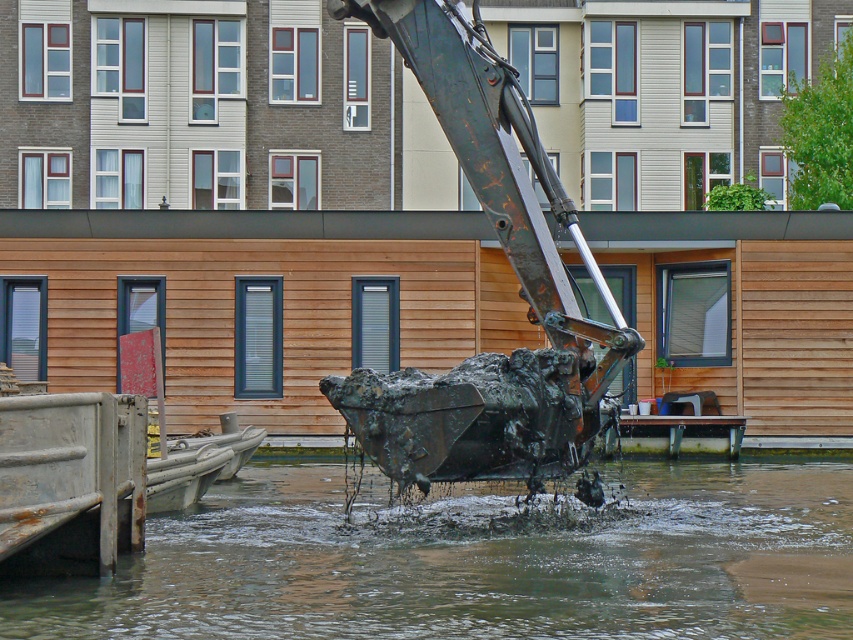
Does translucent water at center have a greater width compared to wooden boat at lower left?

Yes, translucent water at center is wider than wooden boat at lower left.

Who is more distant from viewer, (480, 588) or (227, 461)?

The point (227, 461) is more distant.

This screenshot has width=853, height=640. What do you see at coordinates (477, 561) in the screenshot? I see `translucent water at center` at bounding box center [477, 561].

Identify the location of translucent water at center. The height and width of the screenshot is (640, 853). (477, 561).

Which is below, smooth wooden dock at center or wooden boat at lower left?

smooth wooden dock at center is below.

From the picture: Does smooth wooden dock at center have a smaller size compared to wooden boat at lower left?

No.

Identify the location of smooth wooden dock at center. This screenshot has height=640, width=853. (682, 435).

Is rusty metal excavator at center smaller than wooden boat at lower left?

No, rusty metal excavator at center is not smaller than wooden boat at lower left.

Is rusty metal excavator at center bigger than wooden boat at lower left?

Correct, rusty metal excavator at center is larger in size than wooden boat at lower left.

Measure the distance between rusty metal excavator at center and camera.

The distance of rusty metal excavator at center from camera is 54.15 feet.

Locate an element on the screen. The width and height of the screenshot is (853, 640). rusty metal excavator at center is located at coordinates pyautogui.click(x=514, y=272).